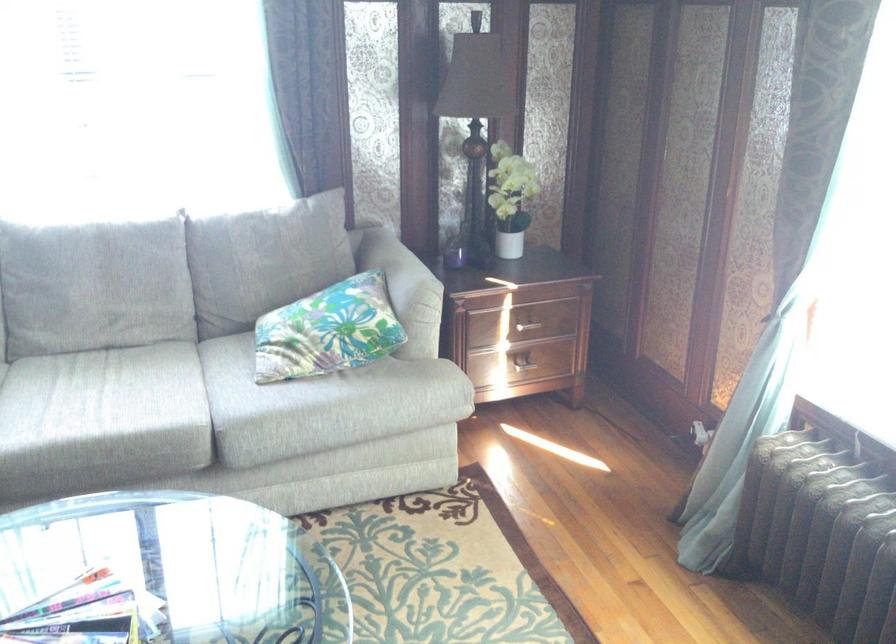
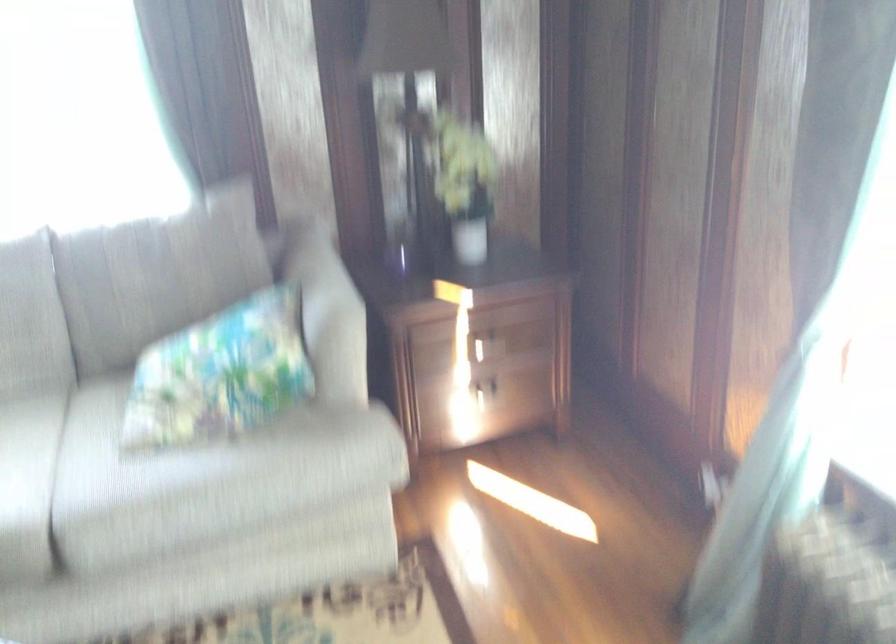
Where in the second image is the point corresponding to (407,274) from the first image?

(326, 296)